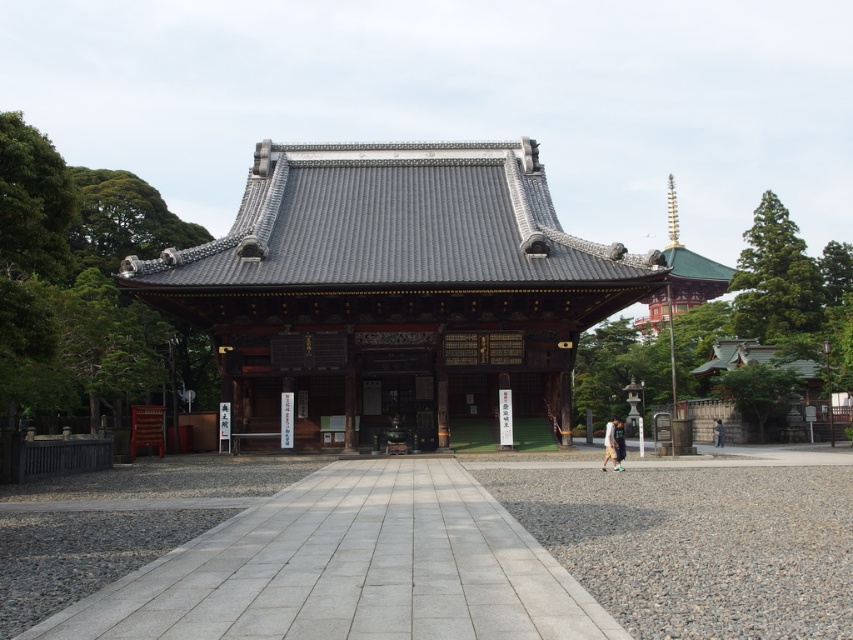
You are a visitor approaching the temple and want to walk up the gray stone path at center to reach the shiny dark gray temple at center. Based on their widths, will you have enough space to walk comfortably?

The shiny dark gray temple at center might be wider than the gray stone path at center, so the path might be narrower than the temple. Therefore, there might not be enough space to walk comfortably.

You are a visitor approaching the temple and want to walk directly towards the shiny dark gray temple at center. Which direction should you walk relative to the gray stone path at center?

The shiny dark gray temple at center is positioned over the gray stone path at center, so you should walk along the gray stone path at center directly towards the temple.